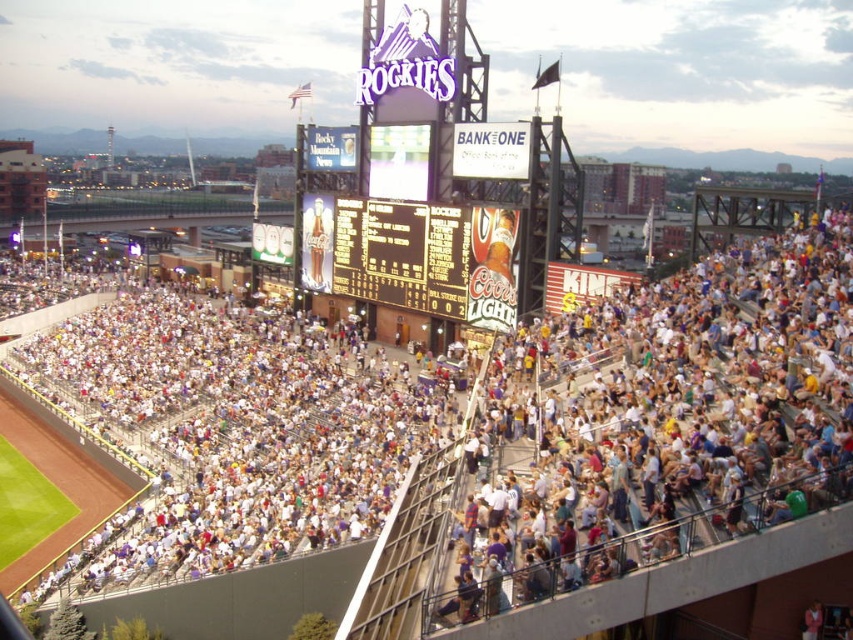
Who is more distant from viewer, (158, 548) or (415, 253)?

The point (415, 253) is more distant.

Is white plastic seats at center thinner than black plastic scoreboard at center?

No, white plastic seats at center is not thinner than black plastic scoreboard at center.

Looking at this image, who is more forward, (154, 365) or (432, 282)?

Point (432, 282) is in front.

The height and width of the screenshot is (640, 853). In order to click on white plastic seats at center in this screenshot , I will do `click(468, 442)`.

Is point (537, 346) farther from viewer compared to point (138, 328)?

That is False.

Who is more forward, (640, 490) or (231, 448)?

Point (640, 490) is more forward.

You are a GUI agent. You are given a task and a screenshot of the screen. Output one action in this format:
    pyautogui.click(x=<x>, y=<y>)
    Task: Click on the white fabric crowd at upper right
    The width and height of the screenshot is (853, 640).
    Given the screenshot: What is the action you would take?
    pyautogui.click(x=670, y=420)

Between point (289, 360) and point (447, 314), which one is positioned behind?

The point (289, 360) is behind.

Does white fabric crowd at lower left have a greater width compared to black plastic scoreboard at center?

Indeed, white fabric crowd at lower left has a greater width compared to black plastic scoreboard at center.

Between point (326, 499) and point (434, 316), which one is positioned behind?

The point (434, 316) is more distant.

Find the location of a particular element. This screenshot has height=640, width=853. white fabric crowd at lower left is located at coordinates (225, 435).